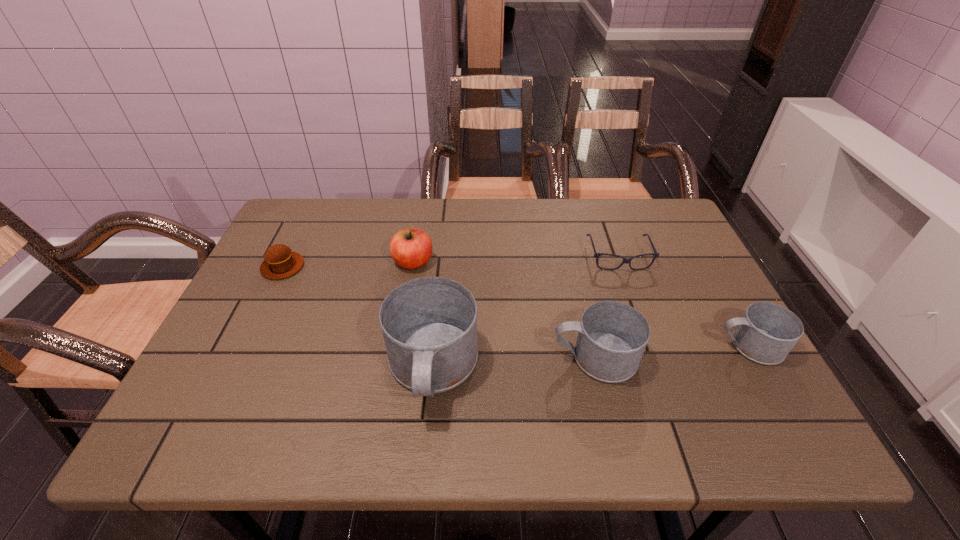
Where is `the third closest mug relative to the apple`? the third closest mug relative to the apple is located at coordinates (767, 332).

The height and width of the screenshot is (540, 960). In order to click on vacant space that satisfies the following two spatial constraints: 1. on the side of the third shortest object with the handle; 2. on the side of the leftmost mug with the handle in this screenshot , I will do `click(762, 369)`.